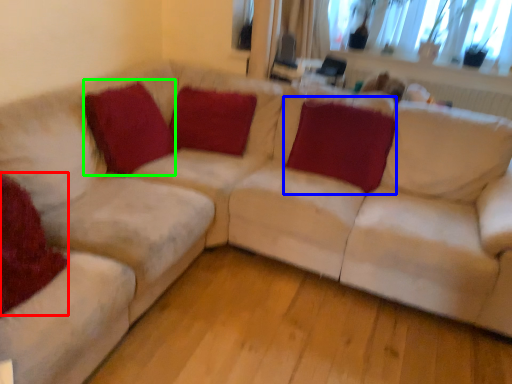
Question: Which object is positioned closest to pillow (highlighted by a red box)? Select from pillow (highlighted by a blue box) and pillow (highlighted by a green box).

Choices:
 (A) pillow
 (B) pillow

Answer: (B)